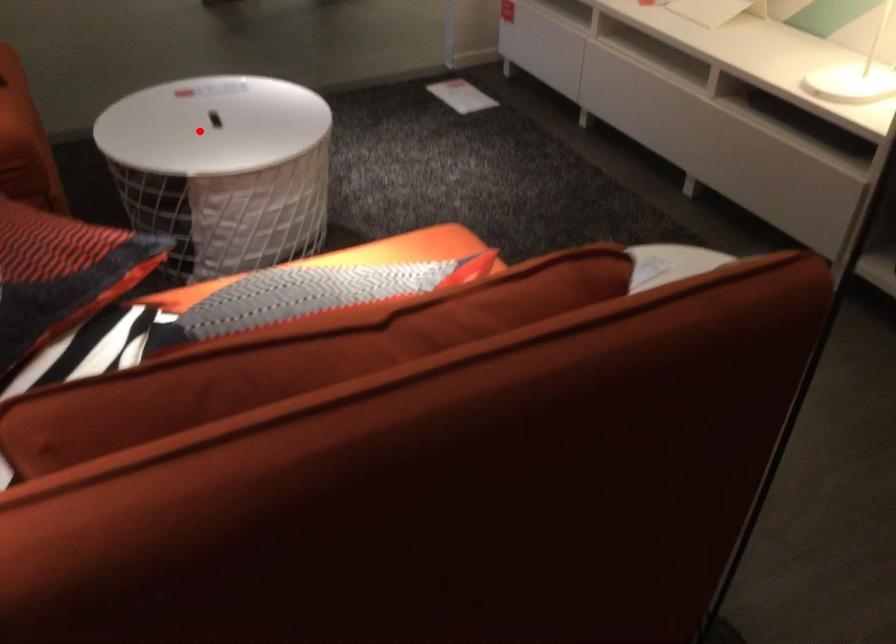
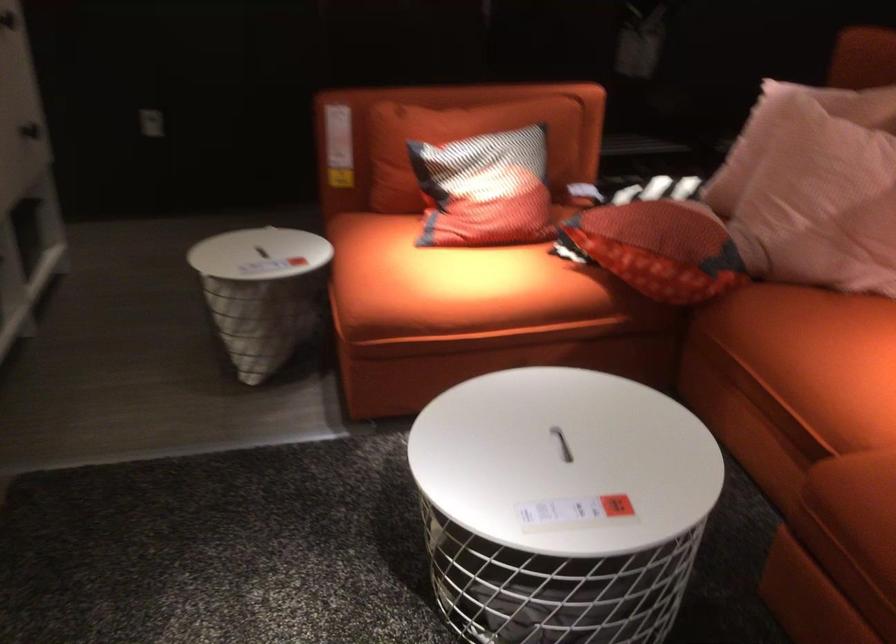
Question: I am providing you with two images of the same scene from different viewpoints. Image1 has a red point marked. In image2, the corresponding 3D location appears at what relative position? Reply with the corresponding letter.

Choices:
 (A) Closer
 (B) Farther

Answer: (A)